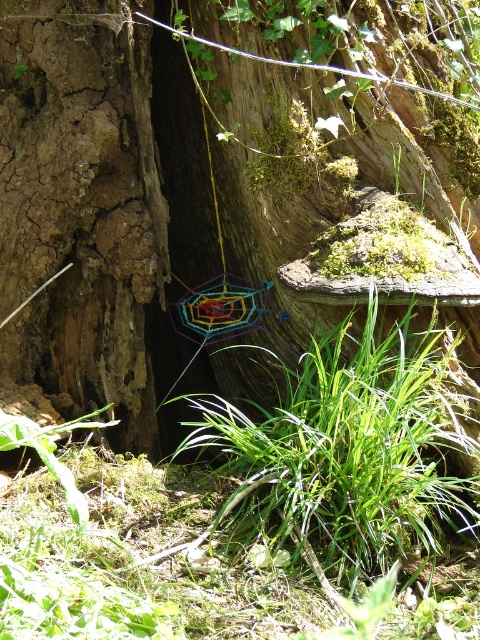
You are a squirrel trying to find a hiding spot between the wooden tree trunk at center and the green grass at center. Which one is taller?

The wooden tree trunk at center is much taller than the green grass at center, so it would be the taller option for hiding.

You are a painter standing in front of the scene. You want to paint the wooden tree trunk at center and the green grass at center. Which object is wider?

The wooden tree trunk at center is wider than the green grass at center.

You are standing in a forest and see the brown rough tree trunk at left and the green grass at center. Which object is higher up in the scene?

The brown rough tree trunk at left is located above the green grass at center, so it is higher up in the scene.